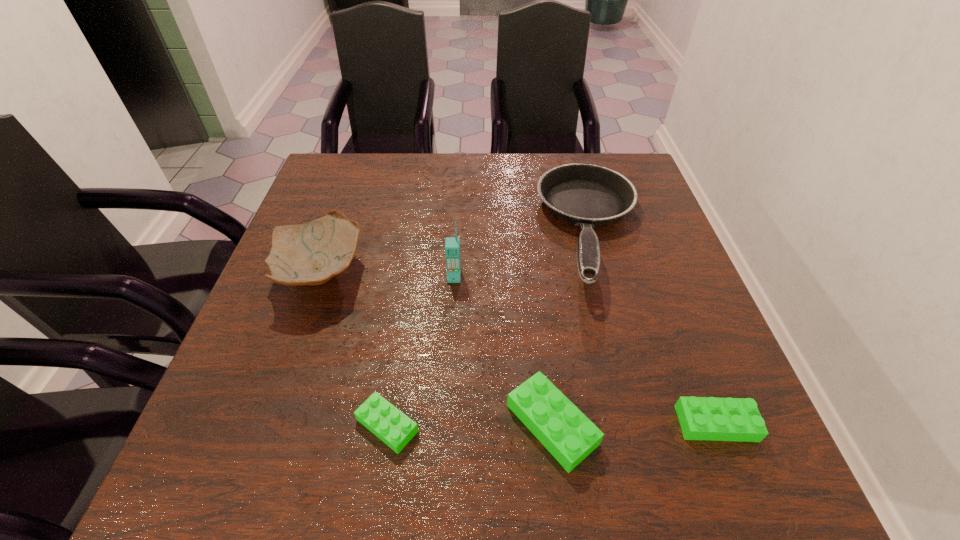
The Legos are evenly distributed in the image. To maintain this, where would you place another Lego on the left? Please point to a free space. Please provide its 2D coordinates. Your answer should be formatted as a tuple, i.e. [(x, y)], where the tuple contains the x and y coordinates of a point satisfying the conditions above.

[(223, 426)]